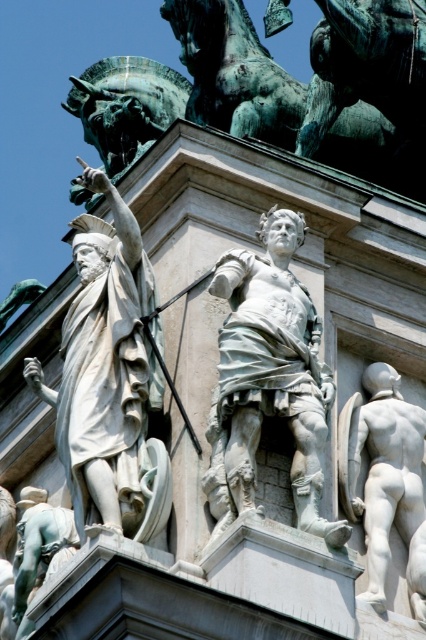
You are an art student analyzing the classical sculpture. You notice the white marble statue at center and the white marble nude figure at lower right. Which one is positioned higher in the composition?

The white marble statue at center is positioned higher than the white marble nude figure at lower right.

You are an art student standing in front of a classical sculpture. You see the white marble statue at left and the white marble statue at center. Which statue is positioned more to the east?

The white marble statue at left is positioned to the left of the white marble statue at center. Since you are facing the sculpture, the statue on the left would be to the east if the center statue is facing forward. Therefore, the white marble statue at left is more to the east.

You are an art conservator assessing the spatial arrangement of two statues in a classical sculpture. The statues are the white marble statue at left and the white marble statue at center. Based on their sizes, which statue would require more space for proper preservation? Explain your reasoning.

The white marble statue at left requires more space for proper preservation because its width is larger than the white marble statue at center, necessitating adequate room to accommodate its size during conservation processes.